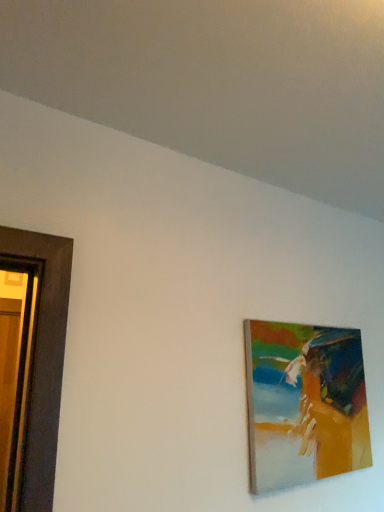
What are the coordinates of `painted wood picture frame at upper right` in the screenshot? It's located at (304, 404).

The image size is (384, 512). Describe the element at coordinates (304, 404) in the screenshot. I see `painted wood picture frame at upper right` at that location.

Measure the distance between point (361, 451) and camera.

Point (361, 451) is 5.45 feet away from camera.

Locate an element on the screen. This screenshot has width=384, height=512. painted wood picture frame at upper right is located at coordinates (304, 404).